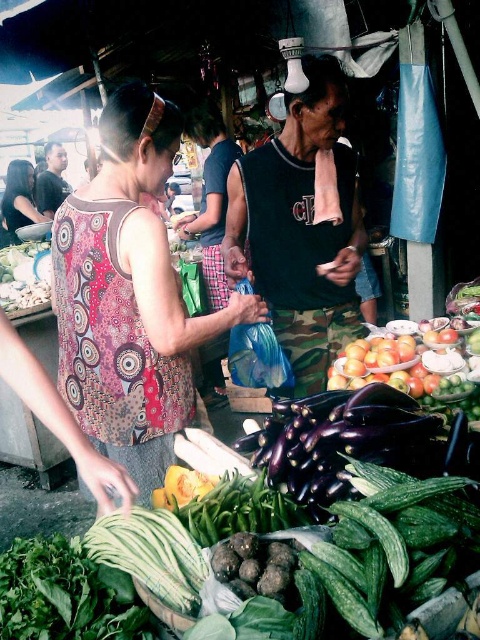
Question: Which object is the farthest from the patterned fabric dress at center?

Choices:
 (A) printed fabric tank top at center
 (B) green leafy at lower left

Answer: (B)

Question: Can you confirm if printed fabric tank top at center is bigger than patterned fabric dress at center?

Choices:
 (A) yes
 (B) no

Answer: (B)

Question: In this image, where is printed fabric tank top at center located relative to camo fabric pants at center?

Choices:
 (A) left
 (B) right

Answer: (A)

Question: Does printed fabric tank top at center have a larger size compared to green leafy at lower left?

Choices:
 (A) no
 (B) yes

Answer: (B)

Question: Which is farther from the green leafy at lower left?

Choices:
 (A) printed fabric tank top at center
 (B) patterned fabric dress at center
 (C) camo fabric pants at center

Answer: (B)

Question: Which point appears farthest from the camera in this image?

Choices:
 (A) (19, 188)
 (B) (244, 296)
 (C) (48, 584)
 (D) (288, 131)

Answer: (A)